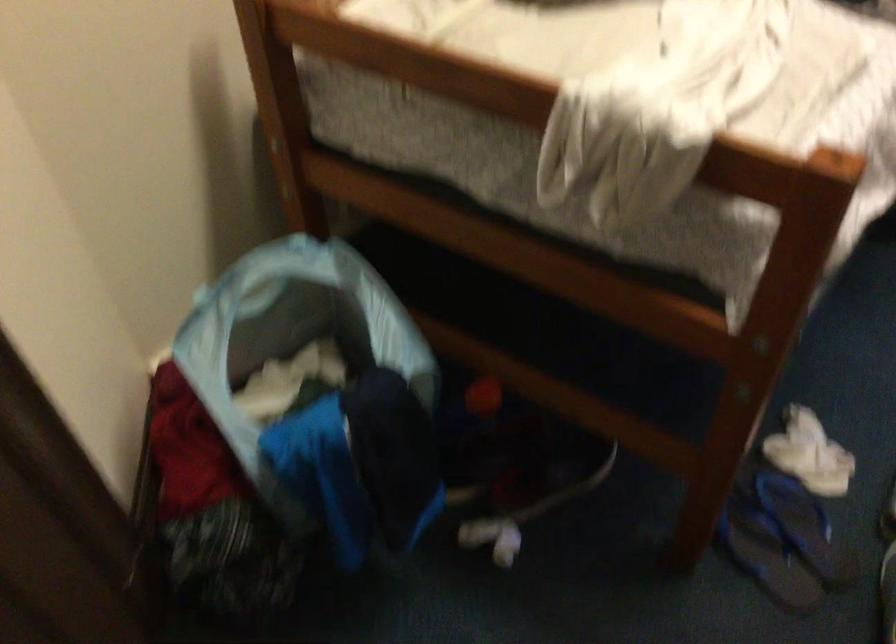
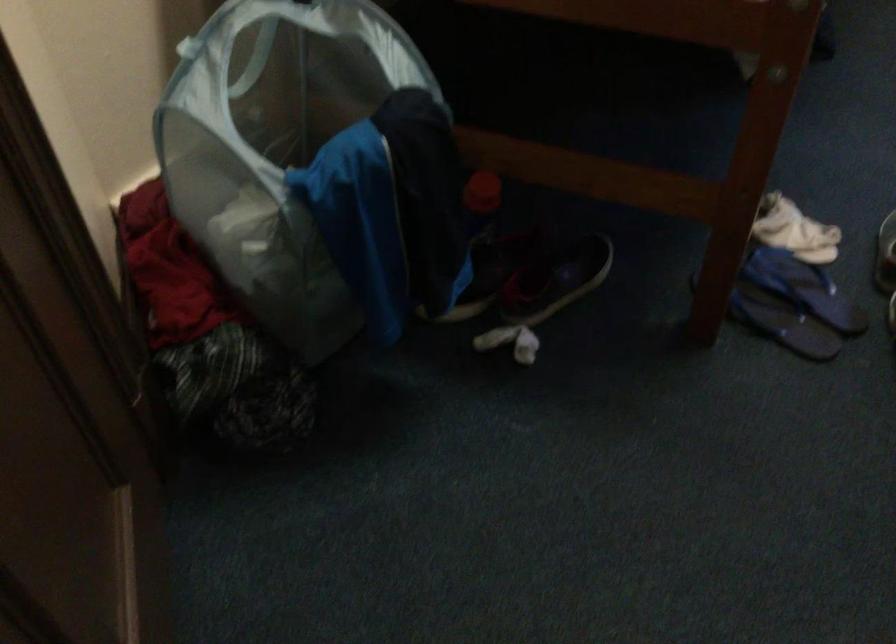
Locate, in the second image, the point that corresponds to [798,526] in the first image.

(804, 288)